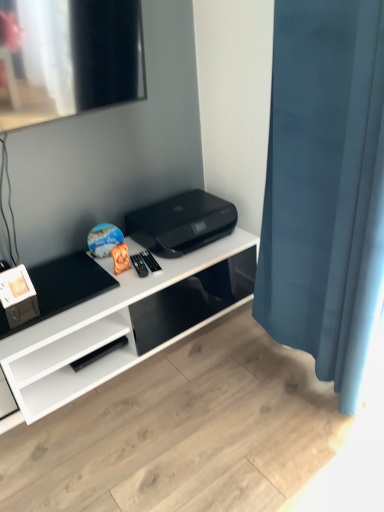
Question: Is the depth of blue velvet curtain at right greater than that of black plastic printer at center?

Choices:
 (A) no
 (B) yes

Answer: (A)

Question: From the image's perspective, does blue velvet curtain at right appear higher than black plastic printer at center?

Choices:
 (A) yes
 (B) no

Answer: (B)

Question: Is blue velvet curtain at right at the right side of black plastic printer at center?

Choices:
 (A) no
 (B) yes

Answer: (B)

Question: From the image's perspective, would you say blue velvet curtain at right is shown under black plastic printer at center?

Choices:
 (A) no
 (B) yes

Answer: (B)

Question: Is blue velvet curtain at right turned away from black plastic printer at center?

Choices:
 (A) yes
 (B) no

Answer: (B)

Question: Considering their positions, is blue velvet curtain at right located in front of or behind black plastic printer at center?

Choices:
 (A) behind
 (B) front

Answer: (B)

Question: In terms of size, does blue velvet curtain at right appear bigger or smaller than black plastic printer at center?

Choices:
 (A) small
 (B) big

Answer: (B)

Question: Is blue velvet curtain at right to the left or to the right of black plastic printer at center in the image?

Choices:
 (A) left
 (B) right

Answer: (B)

Question: Would you say blue velvet curtain at right is inside or outside black plastic printer at center?

Choices:
 (A) outside
 (B) inside

Answer: (A)

Question: Which is correct: black plastic printer at center is inside white glossy desk at center, or outside of it?

Choices:
 (A) outside
 (B) inside

Answer: (A)

Question: Is black plastic printer at center bigger or smaller than white glossy desk at center?

Choices:
 (A) big
 (B) small

Answer: (B)

Question: From the image's perspective, is black plastic printer at center located above or below white glossy desk at center?

Choices:
 (A) above
 (B) below

Answer: (A)

Question: Is point (129, 219) closer or farther from the camera than point (99, 329)?

Choices:
 (A) closer
 (B) farther

Answer: (B)

Question: Is white glossy desk at center wider or thinner than blue velvet curtain at right?

Choices:
 (A) wide
 (B) thin

Answer: (A)

Question: Based on their sizes in the image, would you say white glossy desk at center is bigger or smaller than blue velvet curtain at right?

Choices:
 (A) big
 (B) small

Answer: (A)